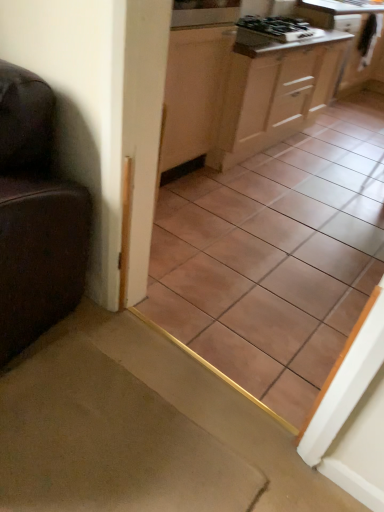
Question: From a real-world perspective, is wooden cabinet at upper right, which is the 1th cabinetry in right-to-left order, located higher than carpet at lower left?

Choices:
 (A) yes
 (B) no

Answer: (A)

Question: Does wooden cabinet at upper right, the first cabinetry viewed from the back, turn towards carpet at lower left?

Choices:
 (A) yes
 (B) no

Answer: (B)

Question: From the image's perspective, is wooden cabinet at upper right, which is the 1th cabinetry in right-to-left order, on carpet at lower left?

Choices:
 (A) no
 (B) yes

Answer: (B)

Question: Does wooden cabinet at upper right, the 2th cabinetry viewed from the left, have a larger size compared to carpet at lower left?

Choices:
 (A) yes
 (B) no

Answer: (A)

Question: Is wooden cabinet at upper right, which is the 1th cabinetry in right-to-left order, wider than carpet at lower left?

Choices:
 (A) no
 (B) yes

Answer: (A)

Question: In terms of width, does white glossy countertop at upper right look wider or thinner when compared to wooden cabinet at upper right, the first cabinetry viewed from the back?

Choices:
 (A) wide
 (B) thin

Answer: (B)

Question: Based on their positions, is white glossy countertop at upper right located to the left or right of wooden cabinet at upper right, the 2th cabinetry viewed from the left?

Choices:
 (A) left
 (B) right

Answer: (B)

Question: Considering the positions of white glossy countertop at upper right and wooden cabinet at upper right, arranged as the 2th cabinetry when viewed from the front, in the image, is white glossy countertop at upper right taller or shorter than wooden cabinet at upper right, arranged as the 2th cabinetry when viewed from the front,?

Choices:
 (A) short
 (B) tall

Answer: (A)

Question: In the image, is white glossy countertop at upper right positioned in front of or behind wooden cabinet at upper right, the 2th cabinetry viewed from the left?

Choices:
 (A) behind
 (B) front

Answer: (A)

Question: Based on their positions, is wooden cabinet at upper right, arranged as the 2th cabinetry when viewed from the front, located to the left or right of brown ceramic tile at center?

Choices:
 (A) right
 (B) left

Answer: (A)

Question: Considering the positions of wooden cabinet at upper right, arranged as the 2th cabinetry when viewed from the front, and brown ceramic tile at center in the image, is wooden cabinet at upper right, arranged as the 2th cabinetry when viewed from the front, taller or shorter than brown ceramic tile at center?

Choices:
 (A) tall
 (B) short

Answer: (B)

Question: Does point (334, 25) appear closer or farther from the camera than point (342, 315)?

Choices:
 (A) closer
 (B) farther

Answer: (B)

Question: Based on their sizes in the image, would you say wooden cabinet at upper right, the first cabinetry viewed from the back, is bigger or smaller than brown ceramic tile at center?

Choices:
 (A) small
 (B) big

Answer: (B)

Question: Is black glossy gas stove at upper center taller or shorter than carpet at lower left?

Choices:
 (A) tall
 (B) short

Answer: (A)

Question: Visually, is black glossy gas stove at upper center positioned to the left or to the right of carpet at lower left?

Choices:
 (A) left
 (B) right

Answer: (B)